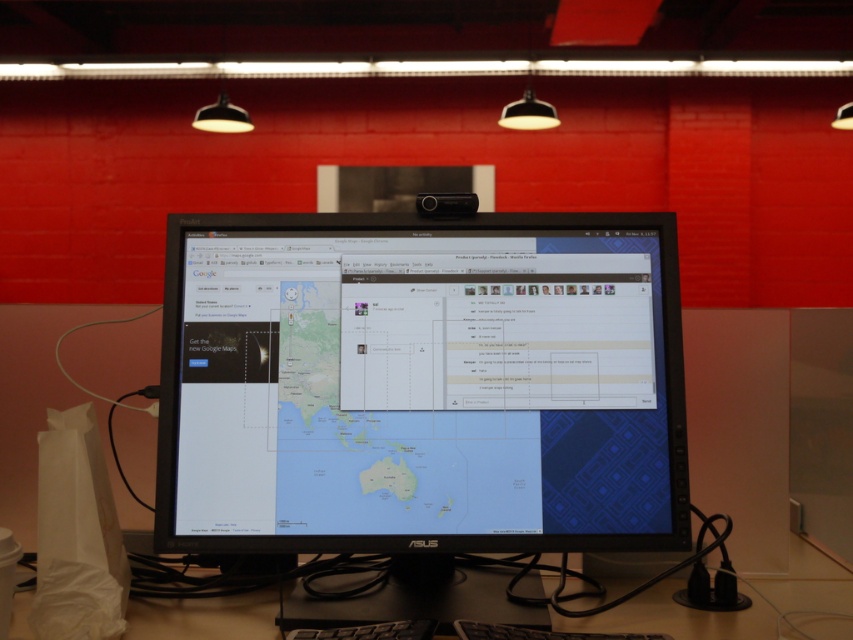
You are setting up a new monitor and want to ensure it fits on your current desk. Given the scene, can the black glossy monitor at center be placed on the black plastic computer desk at lower center without exceeding its width?

The black glossy monitor at center has a width larger than the black plastic computer desk at lower center, so it cannot be placed on the desk without exceeding its width.

You are setting up a new computer monitor and want to place it on the desk. Based on the scene, can you confirm if the black glossy monitor at center will fit to the left of the black plastic computer desk at lower center?

The black glossy monitor at center is already positioned to the left of the black plastic computer desk at lower center, so it fits there.

You are organizing your workspace and want to place a 12 inch wide notebook between the black glossy monitor at center and the black plastic computer desk at lower center. Will there be enough space?

The black glossy monitor at center and black plastic computer desk at lower center are 10.66 inches apart. Since the notebook is 12 inches wide, it won